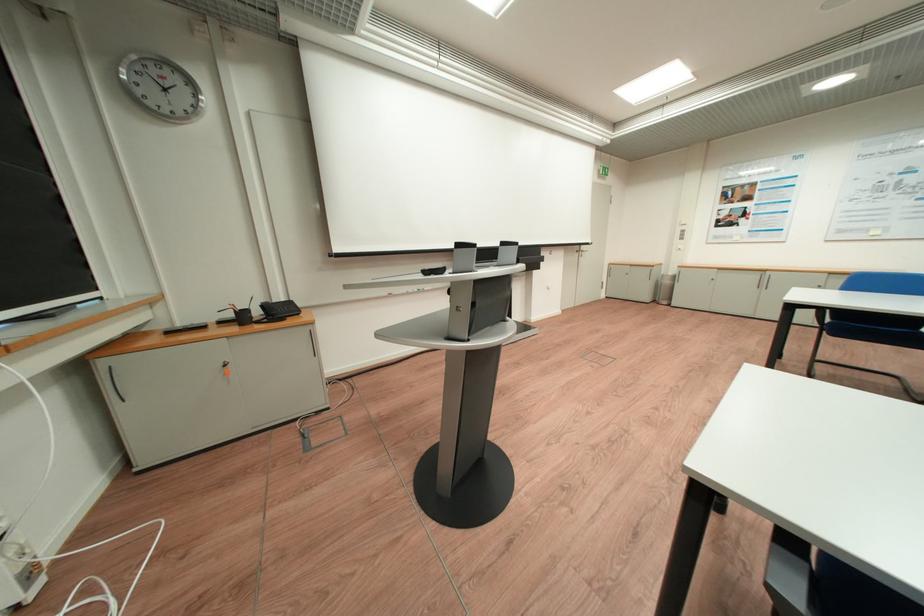
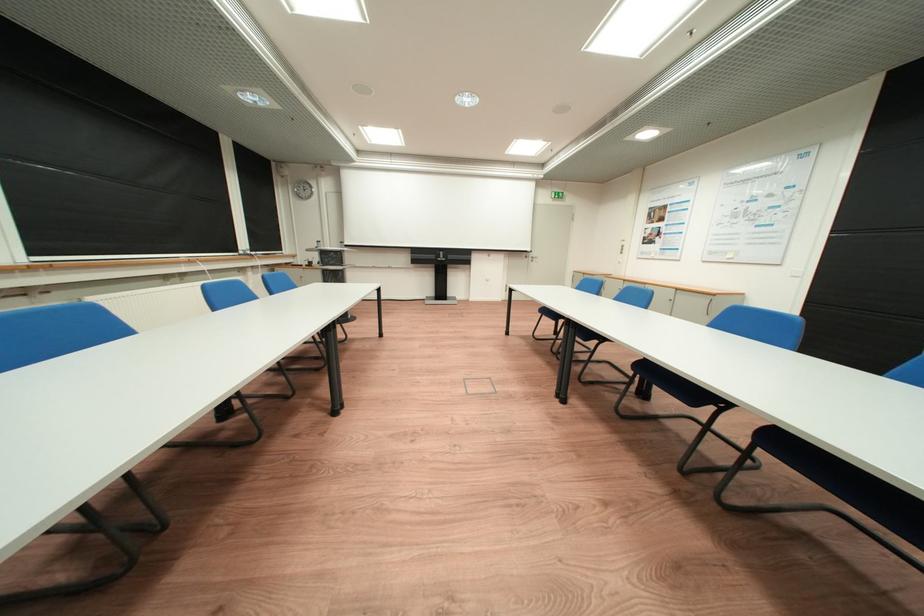
Question: I am providing you with two images of the same scene from different viewpoints. Please identify which objects are invisible in image2.

Choices:
 (A) yellow can handle
 (B) projector screen handle
 (C) blue chair sitting surface
 (D) cabinet handle

Answer: (C)